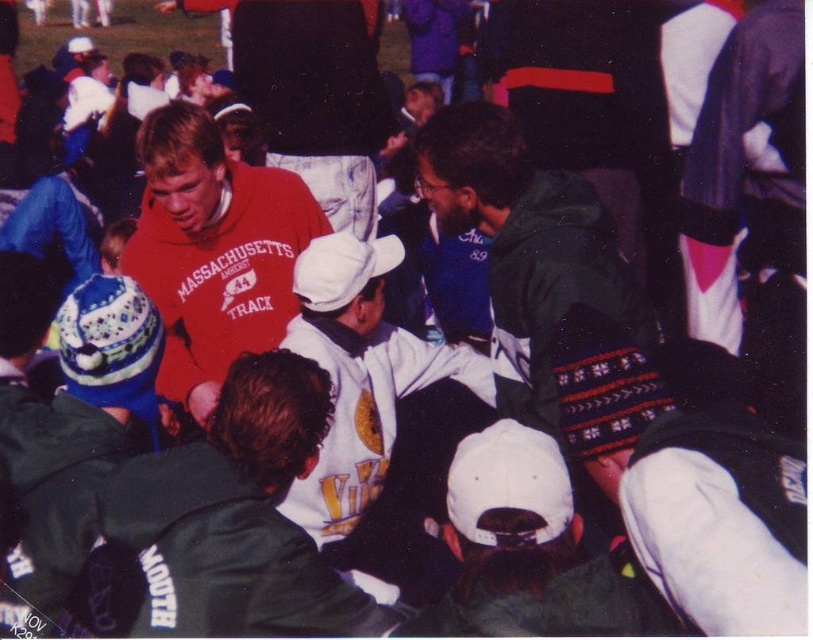
The width and height of the screenshot is (813, 640). What do you see at coordinates (207, 522) in the screenshot? I see `white fleece jacket at center` at bounding box center [207, 522].

The width and height of the screenshot is (813, 640). What are the coordinates of `white fleece jacket at center` in the screenshot? It's located at 207,522.

Does point (129, 458) come closer to viewer compared to point (157, 292)?

Yes.

Identify the location of white fleece jacket at center. This screenshot has width=813, height=640. (207, 522).

Can you confirm if white fleece jacket at center is positioned to the left of knitted wool hat at center?

Indeed, white fleece jacket at center is positioned on the left side of knitted wool hat at center.

Measure the distance between white fleece jacket at center and knitted wool hat at center.

A distance of 96.95 centimeters exists between white fleece jacket at center and knitted wool hat at center.

This screenshot has width=813, height=640. I want to click on white fleece jacket at center, so click(207, 522).

Where is `white fleece jacket at center`? This screenshot has width=813, height=640. white fleece jacket at center is located at coordinates pos(207,522).

Based on the photo, who is positioned more to the left, knitted wool hat at center or matte red sweatshirt at center?

matte red sweatshirt at center is more to the left.

Can you confirm if knitted wool hat at center is positioned below matte red sweatshirt at center?

Yes.

The height and width of the screenshot is (640, 813). Find the location of `knitted wool hat at center`. knitted wool hat at center is located at coordinates (689, 476).